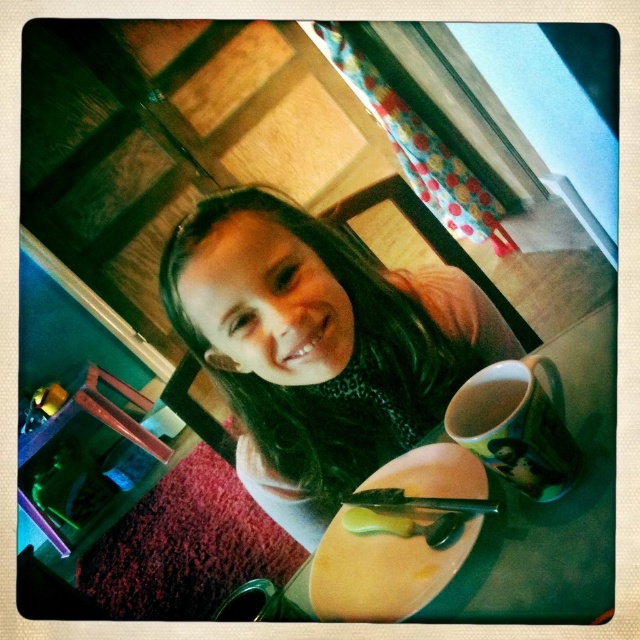
Question: Among these points, which one is farthest from the camera?

Choices:
 (A) [x=385, y=548]
 (B) [x=451, y=417]
 (C) [x=200, y=204]
 (D) [x=577, y=452]

Answer: (C)

Question: Considering the relative positions of green matte mug at lower right and matte white cup at lower right in the image provided, where is green matte mug at lower right located with respect to matte white cup at lower right?

Choices:
 (A) left
 (B) right

Answer: (B)

Question: Is the position of green matte mug at lower right less distant than that of matte white cup at lower right?

Choices:
 (A) no
 (B) yes

Answer: (B)

Question: Considering the real-world distances, which object is farthest from the matte black shirt at center?

Choices:
 (A) yellow buttery spread at lower center
 (B) yellow matte plate at center
 (C) matte white cup at lower right

Answer: (C)

Question: Which point is farther to the camera?

Choices:
 (A) yellow buttery spread at lower center
 (B) matte white cup at lower right
 (C) matte black shirt at center

Answer: (A)

Question: Does yellow matte plate at center appear under matte white cup at lower right?

Choices:
 (A) yes
 (B) no

Answer: (A)